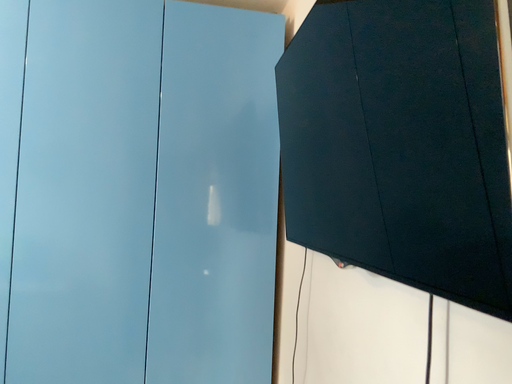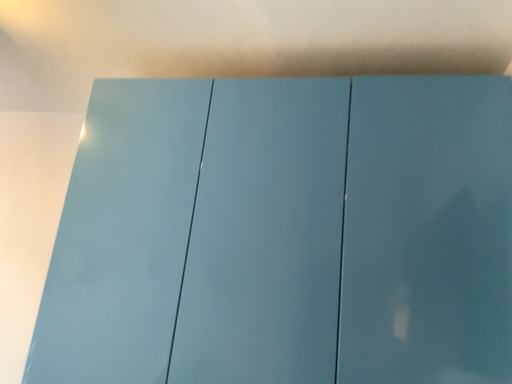
Question: Which way did the camera rotate in the video?

Choices:
 (A) rotated right
 (B) rotated left

Answer: (B)